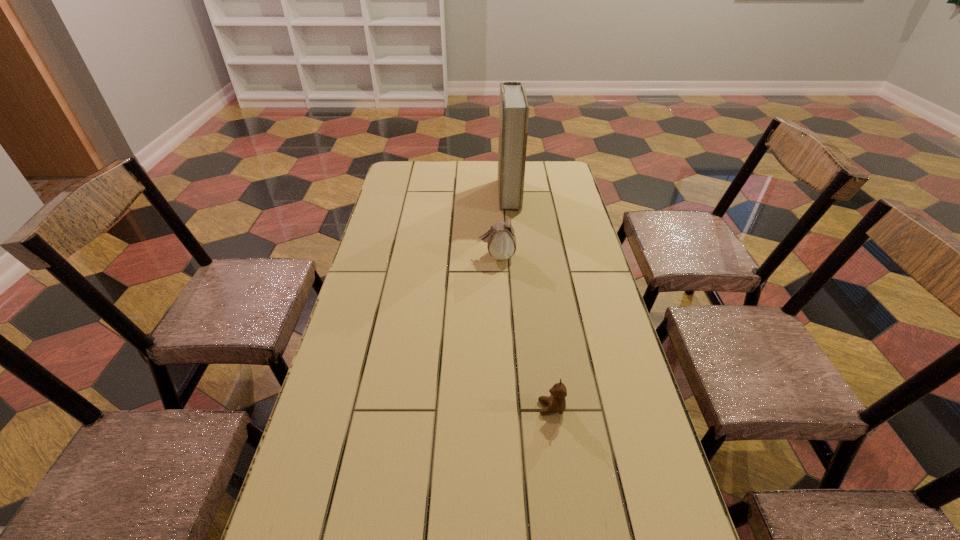
You are a GUI agent. You are given a task and a screenshot of the screen. Output one action in this format:
    pyautogui.click(x=<x>, y=<y>)
    Task: Click on the vacant space in between the second farthest object and the teddy bear
    
    Given the screenshot: What is the action you would take?
    pyautogui.click(x=524, y=332)

Image resolution: width=960 pixels, height=540 pixels. What are the coordinates of `free space between the nearest object and the farthest object` in the screenshot? It's located at (530, 301).

Find the location of a particular element. The height and width of the screenshot is (540, 960). free space between the pouch and the shortest object is located at coordinates (524, 332).

Locate an element on the screen. free point between the farthest object and the teddy bear is located at coordinates (530, 301).

You are a GUI agent. You are given a task and a screenshot of the screen. Output one action in this format:
    pyautogui.click(x=<x>, y=<y>)
    Task: Click on the free area in between the phonebook and the nearest object
    
    Given the screenshot: What is the action you would take?
    pyautogui.click(x=530, y=301)

Locate an element on the screen. This screenshot has width=960, height=540. vacant space in between the second farthest object and the teddy bear is located at coordinates (524, 332).

Where is `unoccupied position between the tallest object and the shortest object`? This screenshot has width=960, height=540. unoccupied position between the tallest object and the shortest object is located at coordinates (530, 301).

What are the coordinates of `free space between the nearest object and the phonebook` in the screenshot? It's located at (530, 301).

At what (x,y) coordinates should I click in order to perform the action: click on object that is the second closest to the nearest object. Please return your answer as a coordinate pair (x, y). This screenshot has height=540, width=960. Looking at the image, I should click on (514, 110).

Where is `object that is the second closest one to the nearest object`? The width and height of the screenshot is (960, 540). object that is the second closest one to the nearest object is located at coordinates (514, 110).